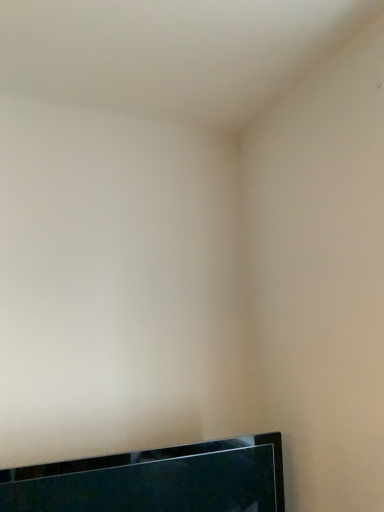
This screenshot has height=512, width=384. Identify the location of black glossy tv at bottom. (156, 480).

Describe the element at coordinates (156, 480) in the screenshot. I see `black glossy tv at bottom` at that location.

You are a GUI agent. You are given a task and a screenshot of the screen. Output one action in this format:
    pyautogui.click(x=<x>, y=<y>)
    Task: Click on the black glossy tv at bottom
    
    Given the screenshot: What is the action you would take?
    pyautogui.click(x=156, y=480)